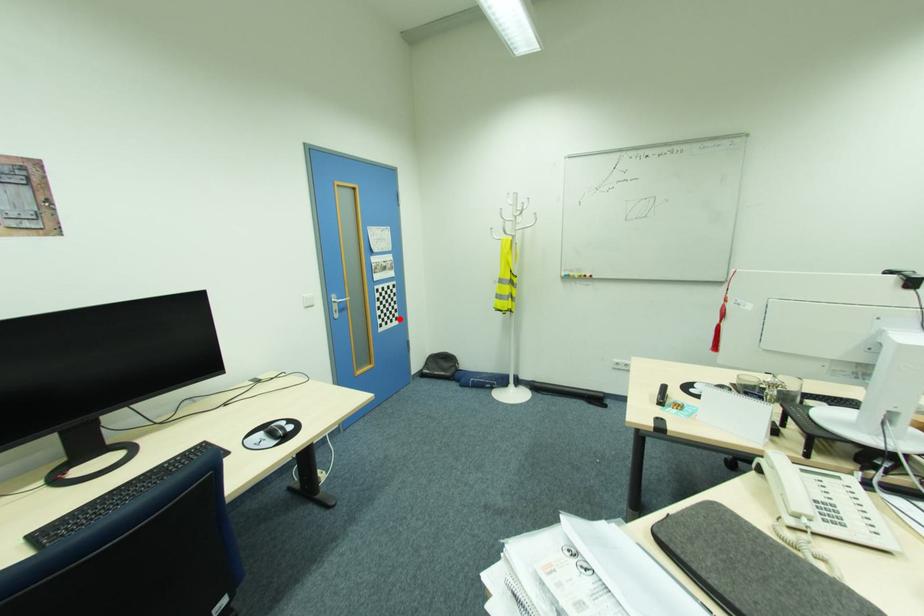
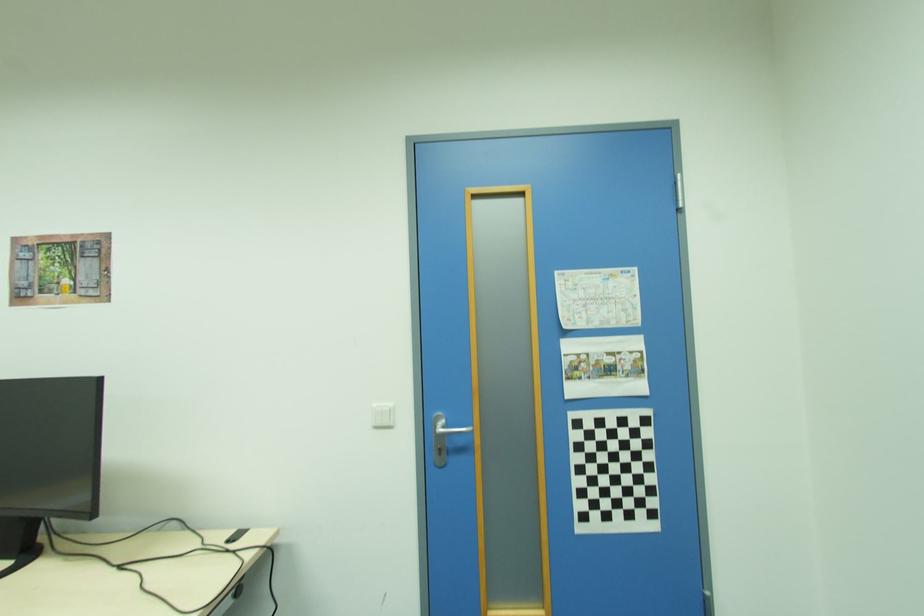
The point at the highlighted location is marked in the first image. Where is the corresponding point in the second image?

(655, 515)